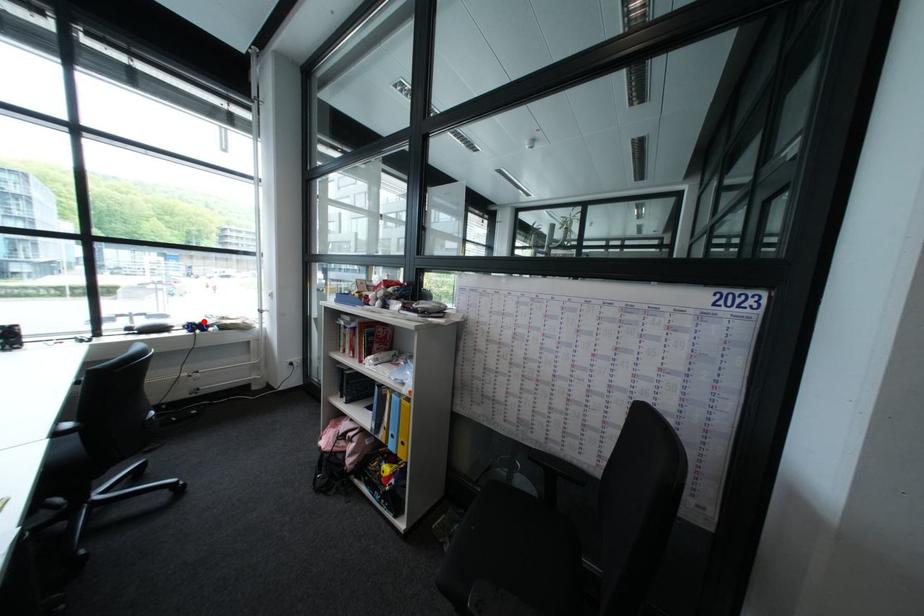
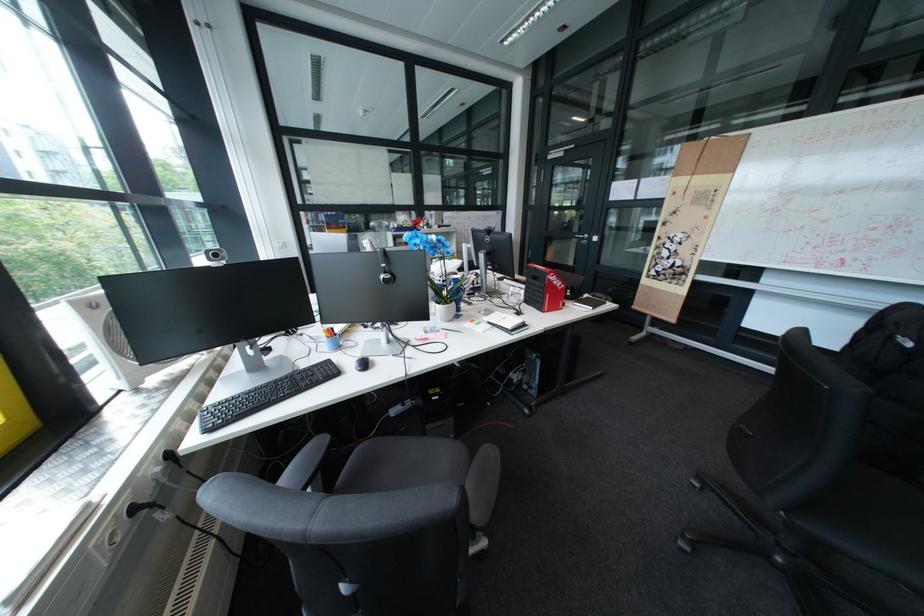
Question: I am providing you with two images of the same scene from different viewpoints. A red point is marked on the first image. Is the red point's position out of view in image 2?

Choices:
 (A) Yes
 (B) No

Answer: (A)